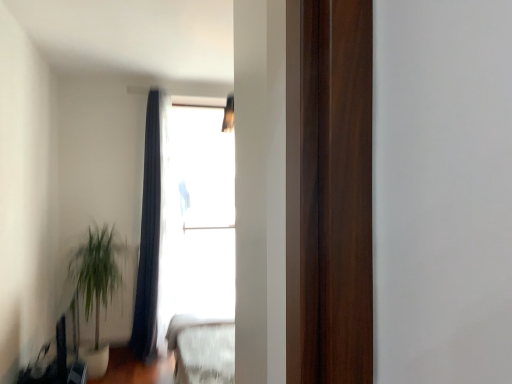
Question: Does point (154, 165) appear closer or farther from the camera than point (100, 291)?

Choices:
 (A) farther
 (B) closer

Answer: (A)

Question: Is dark blue fabric curtain at upper center in front of or behind green leafy plant at lower left in the image?

Choices:
 (A) behind
 (B) front

Answer: (A)

Question: Considering the real-world distances, which object is farthest from the dark blue fabric curtain at upper center?

Choices:
 (A) transparent glass window at upper center
 (B) green leafy plant at lower left

Answer: (B)

Question: Based on their relative distances, which object is farther from the transparent glass window at upper center?

Choices:
 (A) green leafy plant at lower left
 (B) dark blue fabric curtain at upper center

Answer: (A)